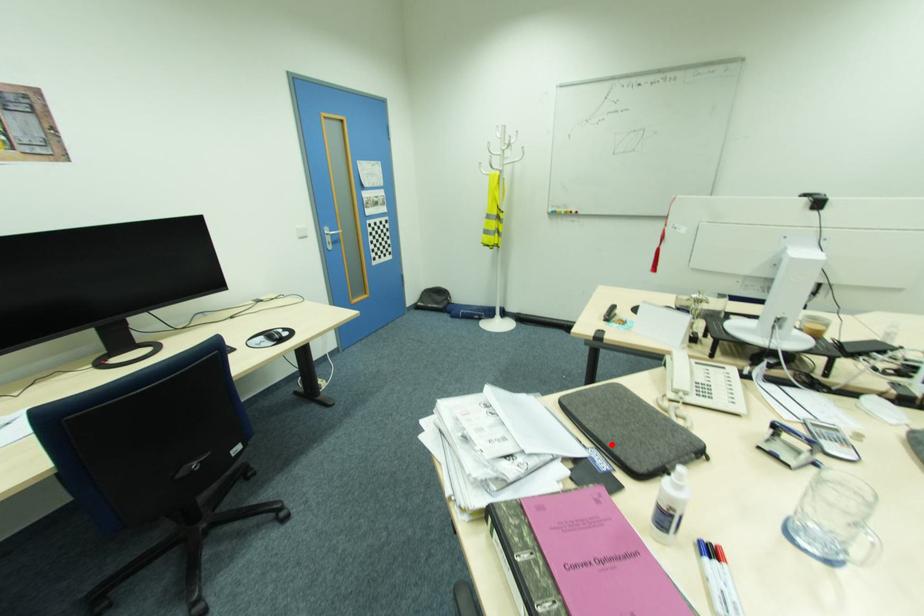
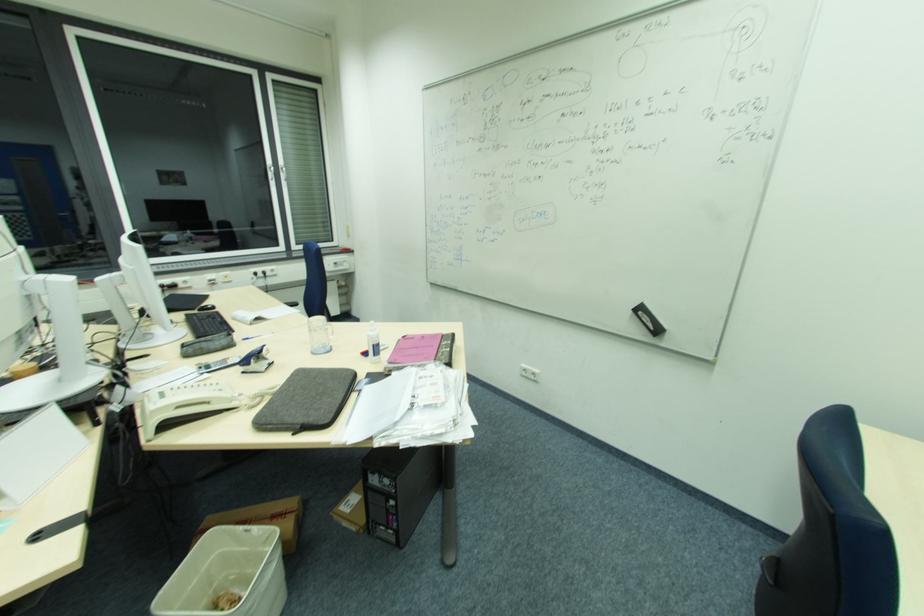
The point at the highlighted location is marked in the first image. Where is the corresponding point in the second image?

(350, 382)